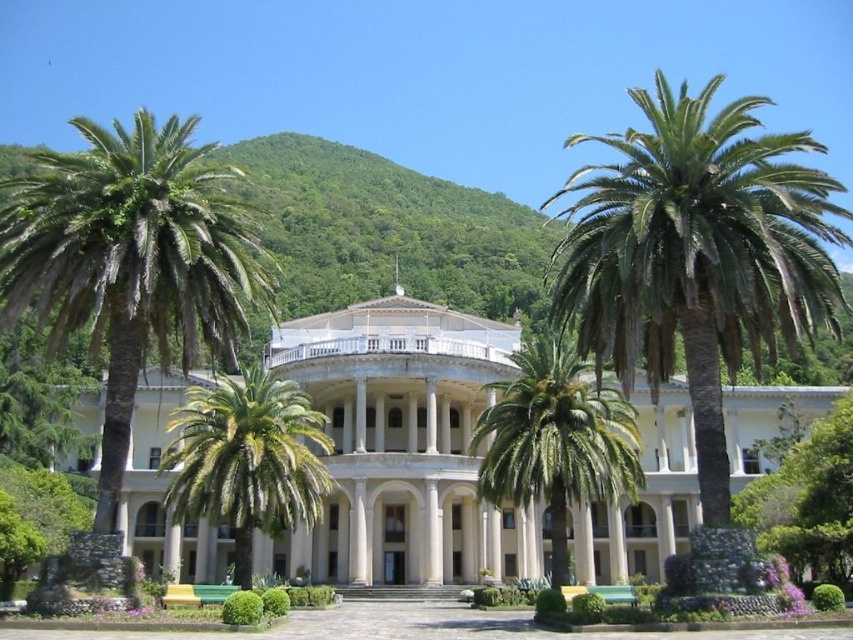
Is green leafy palm at right to the left of green leafy palm at left from the viewer's perspective?

No, green leafy palm at right is not to the left of green leafy palm at left.

Is green leafy palm at right above green leafy palm at left?

Yes, green leafy palm at right is above green leafy palm at left.

Is point (584, 260) positioned after point (123, 240)?

Yes, it is behind point (123, 240).

This screenshot has height=640, width=853. What are the coordinates of `green leafy palm at right` in the screenshot? It's located at pyautogui.click(x=695, y=253).

Between green leafy palm at right and green leafy palm tree at center, which one appears on the right side from the viewer's perspective?

From the viewer's perspective, green leafy palm at right appears more on the right side.

Who is more forward, (637, 340) or (239, 429)?

Point (637, 340) is more forward.

In order to click on green leafy palm at right in this screenshot , I will do `click(695, 253)`.

Is green leafy palm at left positioned at the back of green leafy palm at center?

No, green leafy palm at left is in front of green leafy palm at center.

Is green leafy palm at left taller than green leafy palm at center?

Correct, green leafy palm at left is much taller as green leafy palm at center.

Identify the location of green leafy palm at left. (132, 259).

What are the coordinates of `green leafy palm at left` in the screenshot? It's located at (132, 259).